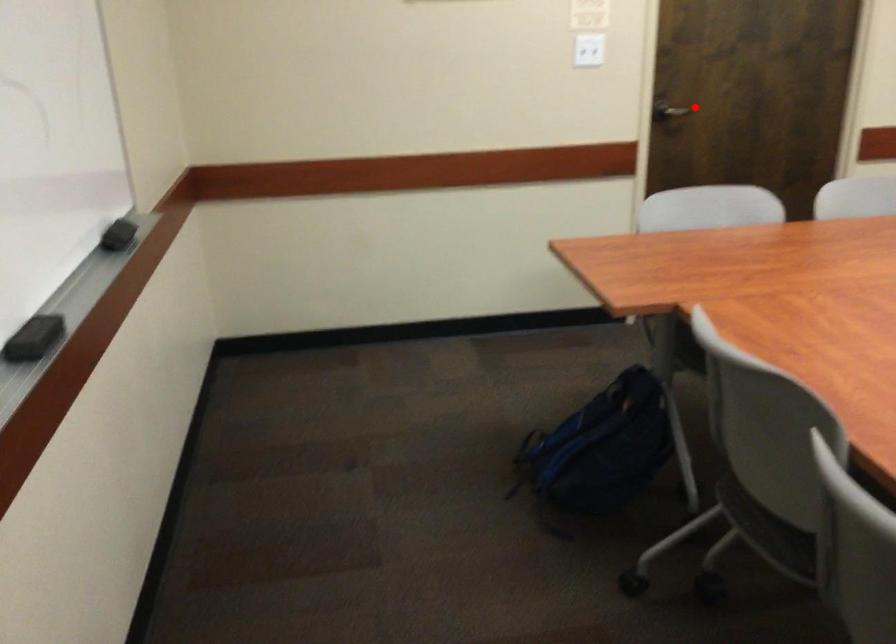
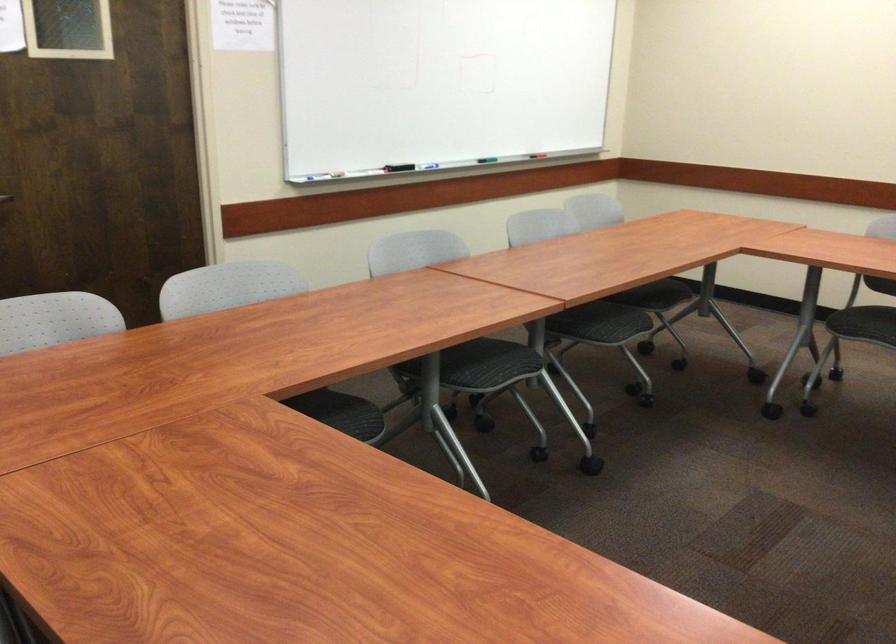
Locate, in the second image, the point that corresponds to the highlighted location in the first image.

(5, 198)